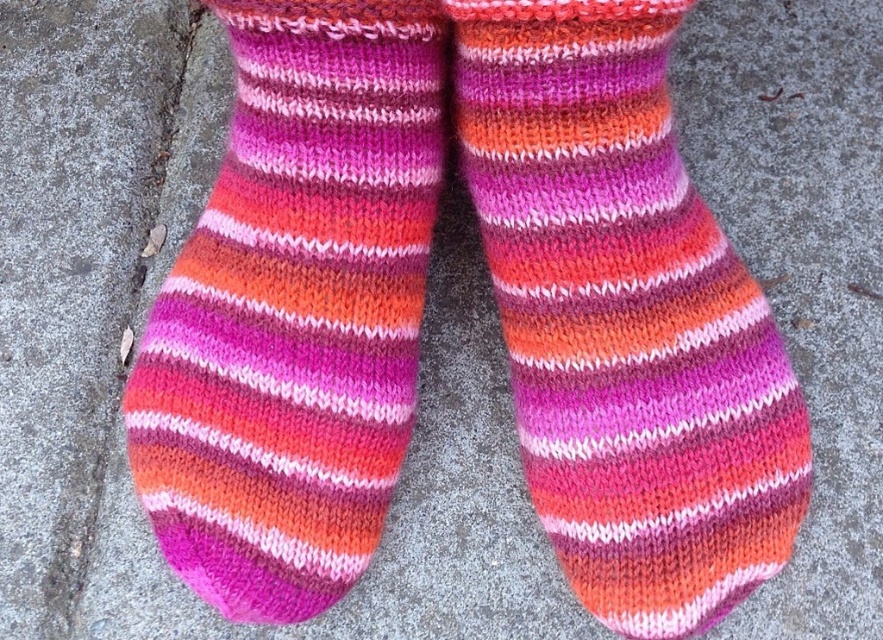
Question: Can you confirm if striped wool sock at center is thinner than striped woolen sock at center?

Choices:
 (A) no
 (B) yes

Answer: (A)

Question: Which point is closer to the camera?

Choices:
 (A) striped woolen sock at center
 (B) striped wool sock at center

Answer: (B)

Question: Can you confirm if striped wool sock at center is bigger than striped woolen sock at center?

Choices:
 (A) no
 (B) yes

Answer: (B)

Question: Does striped wool sock at center have a smaller size compared to striped woolen sock at center?

Choices:
 (A) no
 (B) yes

Answer: (A)